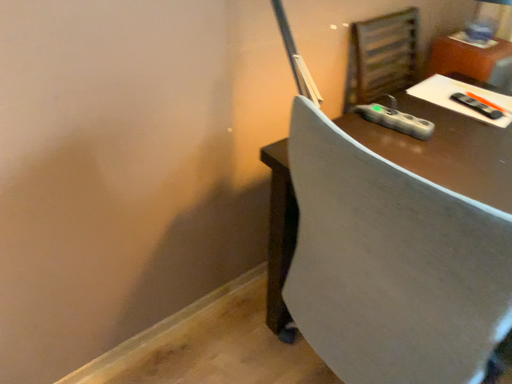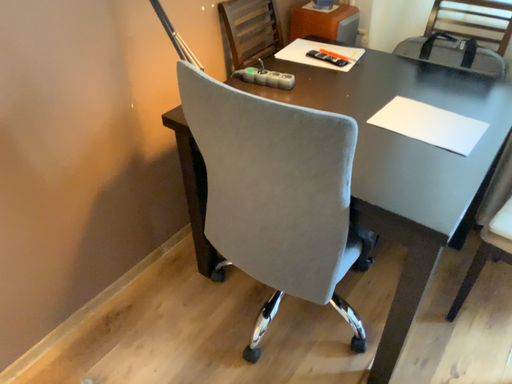
Question: How did the camera likely rotate when shooting the video?

Choices:
 (A) rotated left
 (B) rotated right

Answer: (B)